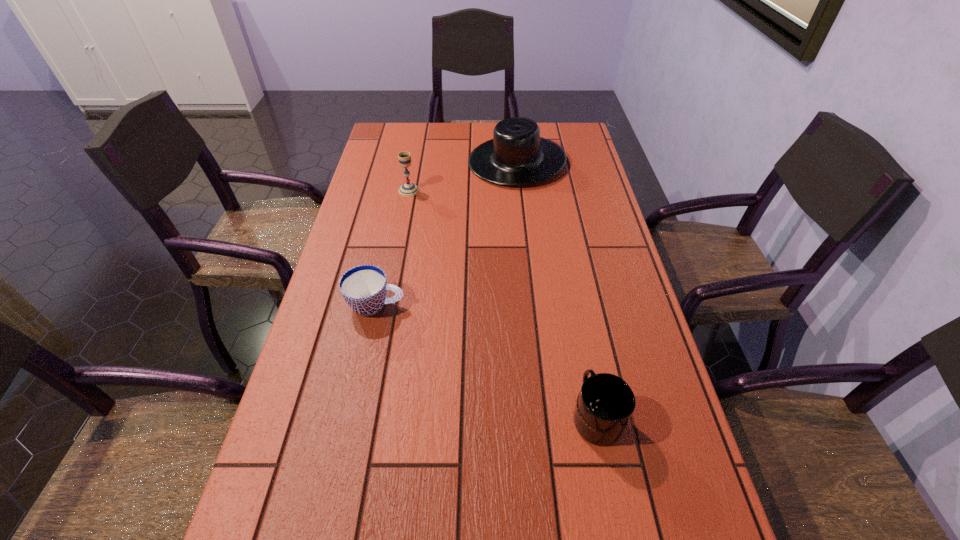
Locate an element on the screen. This screenshot has height=540, width=960. vacant area situated 0.220m with the handle on the side of the mug is located at coordinates (575, 307).

Identify the location of vacant space located on the side of the shortest object with the handle. (438, 305).

This screenshot has height=540, width=960. Identify the location of object at the far edge. (517, 155).

The image size is (960, 540). What are the coordinates of `chalice that is at the left edge` in the screenshot? It's located at [408, 189].

At what (x,y) coordinates should I click in order to perform the action: click on cup located in the left edge section of the desktop. Please return your answer as a coordinate pair (x, y). The height and width of the screenshot is (540, 960). Looking at the image, I should click on (364, 288).

Where is `dress hat that is at the right edge`? dress hat that is at the right edge is located at coordinates (517, 155).

At what (x,y) coordinates should I click in order to perform the action: click on mug present at the right edge. Please return your answer as a coordinate pair (x, y). Looking at the image, I should click on tap(605, 404).

This screenshot has width=960, height=540. Identify the location of object that is at the far right corner. (517, 155).

This screenshot has width=960, height=540. In the image, there is a desktop. Find the location of `free space at the far edge`. free space at the far edge is located at coordinates (440, 126).

Where is `free location at the left edge`? Image resolution: width=960 pixels, height=540 pixels. free location at the left edge is located at coordinates (404, 211).